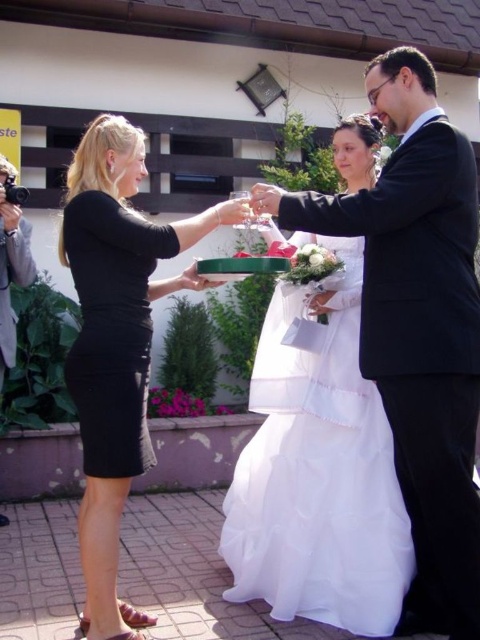
Consider the image. You are a photographer at a wedding. You need to capture a closeup of the two people wearing black satin suit at center and black matte dress at center. Since the camera can only focus on one subject at a time, which one should you choose to ensure the details of their outfit are clear?

The black satin suit at center has a larger size compared to black matte dress at center, so focusing on the black satin suit at center will ensure the details are clear as it takes up more space in the frame.

You are a photographer at the wedding and want to take a photo of the black matte dress at center. Since the matte black camera at left is in the way, can you move the camera to the side to get a clear shot?

The black matte dress at center is positioned under the matte black camera at left, so moving the camera to the side would allow you to take a clear photo of the black matte dress at center without obstruction.